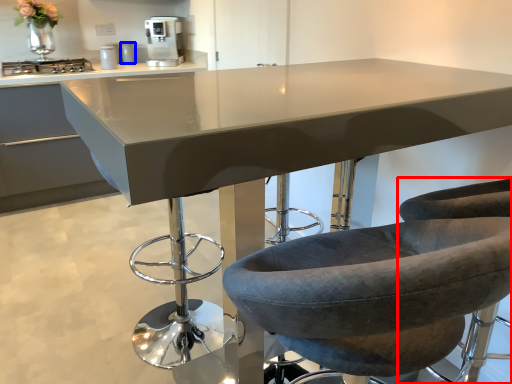
Question: Which object appears closest to the camera in this image, chair (highlighted by a red box) or appliance (highlighted by a blue box)?

Choices:
 (A) chair
 (B) appliance

Answer: (A)